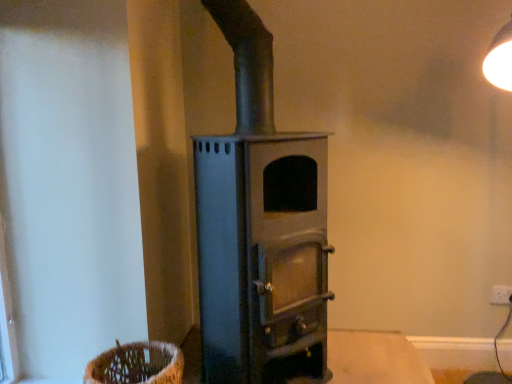
Question: Considering the relative sizes of smooth wooden table at center and woven brown basket at lower left in the image provided, is smooth wooden table at center smaller than woven brown basket at lower left?

Choices:
 (A) yes
 (B) no

Answer: (B)

Question: Is smooth wooden table at center in front of woven brown basket at lower left?

Choices:
 (A) yes
 (B) no

Answer: (B)

Question: Is smooth wooden table at center directly adjacent to woven brown basket at lower left?

Choices:
 (A) no
 (B) yes

Answer: (A)

Question: Does smooth wooden table at center have a lesser height compared to woven brown basket at lower left?

Choices:
 (A) no
 (B) yes

Answer: (B)

Question: Can you confirm if smooth wooden table at center is thinner than woven brown basket at lower left?

Choices:
 (A) yes
 (B) no

Answer: (B)

Question: In terms of width, does smooth wooden table at center look wider or thinner when compared to woven brown basket at lower left?

Choices:
 (A) thin
 (B) wide

Answer: (B)

Question: From the image's perspective, is smooth wooden table at center positioned above or below woven brown basket at lower left?

Choices:
 (A) below
 (B) above

Answer: (A)

Question: Is smooth wooden table at center taller or shorter than woven brown basket at lower left?

Choices:
 (A) short
 (B) tall

Answer: (A)

Question: Choose the correct answer: Is smooth wooden table at center inside woven brown basket at lower left or outside it?

Choices:
 (A) outside
 (B) inside

Answer: (A)

Question: From a real-world perspective, relative to white plastic electric outlet at lower right, is smooth wooden table at center vertically above or below?

Choices:
 (A) above
 (B) below

Answer: (B)

Question: In the image, is smooth wooden table at center positioned in front of or behind white plastic electric outlet at lower right?

Choices:
 (A) front
 (B) behind

Answer: (A)

Question: In the image, is smooth wooden table at center on the left side or the right side of white plastic electric outlet at lower right?

Choices:
 (A) right
 (B) left

Answer: (B)

Question: Considering the positions of point (380, 360) and point (507, 299), is point (380, 360) closer or farther from the camera than point (507, 299)?

Choices:
 (A) farther
 (B) closer

Answer: (B)

Question: Considering the positions of point [x=493, y=286] and point [x=99, y=354], is point [x=493, y=286] closer or farther from the camera than point [x=99, y=354]?

Choices:
 (A) closer
 (B) farther

Answer: (B)

Question: Is white plastic electric outlet at lower right wider or thinner than woven brown basket at lower left?

Choices:
 (A) thin
 (B) wide

Answer: (A)